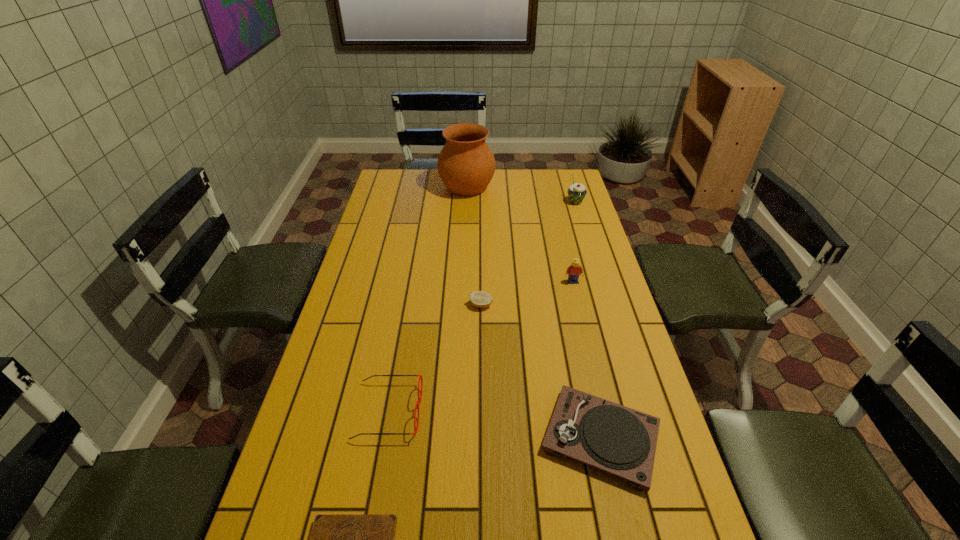
Locate an element on the screen. The image size is (960, 540). vacant space that satisfies the following two spatial constraints: 1. on the front side of the phonograph_record; 2. on the right side of the tallest object is located at coordinates (456, 438).

Image resolution: width=960 pixels, height=540 pixels. Find the location of `free location that satisfies the following two spatial constraints: 1. on the front side of the lemon; 2. on the front-facing side of the spectacles`. free location that satisfies the following two spatial constraints: 1. on the front side of the lemon; 2. on the front-facing side of the spectacles is located at coordinates (481, 411).

This screenshot has height=540, width=960. I want to click on blank space that satisfies the following two spatial constraints: 1. on the back side of the phonograph_record; 2. on the front-facing side of the spectacles, so click(594, 411).